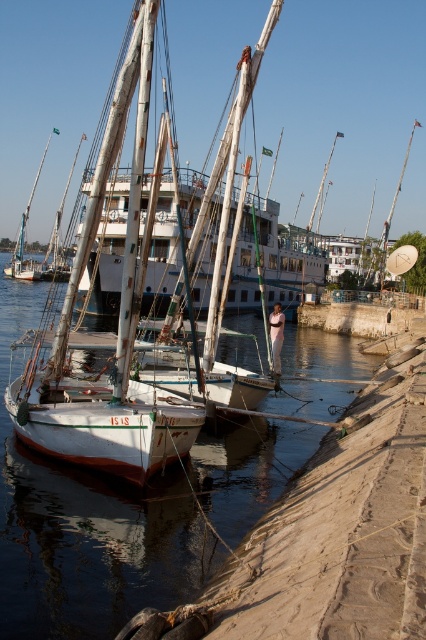
You are a photographer planning to capture a wide shot of the waterfront scene. You want to ensure both the white matte sailboat at center and the white matte mast at upper right are fully visible in the frame. Given their sizes, which object might require you to adjust your camera angle to include it properly?

The white matte mast at upper right is larger than the white matte sailboat at center. Since the mast is taller, you may need to adjust your camera angle to ensure it fits entirely within the frame.

You are a sailor trying to locate the masts in the image. Which mast is positioned to the right of the other between the white matte mast at upper right and the white wood mast at upper center?

The white matte mast at upper right is positioned to the right of the white wood mast at upper center.

You are standing at the water edge and want to take a photo of the two points mentioned in the scene. Which point, point (129, 490) or point (328, 164), will appear larger in your camera view?

Point (129, 490) will appear larger in the camera view because it is closer to the camera than point (328, 164).